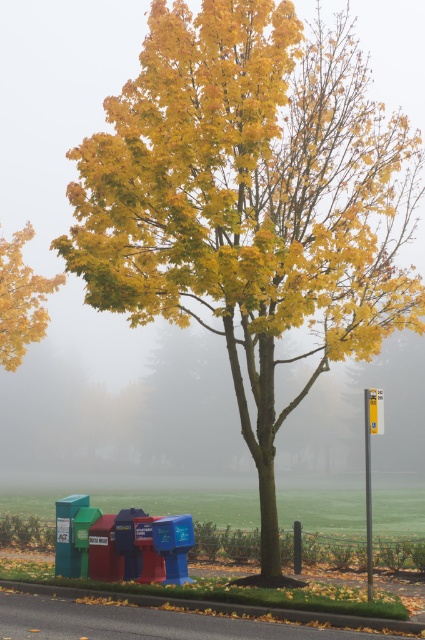
Is point (31, 273) positioned in front of point (340, 620)?

No, (31, 273) is further to viewer.

Can you confirm if yellow matte tree at upper left is positioned to the right of green rubber curb at lower center?

Incorrect, yellow matte tree at upper left is not on the right side of green rubber curb at lower center.

The height and width of the screenshot is (640, 425). Identify the location of yellow matte tree at upper left. (20, 300).

Where is `yellow matte tree at upper left`? The image size is (425, 640). yellow matte tree at upper left is located at coordinates (20, 300).